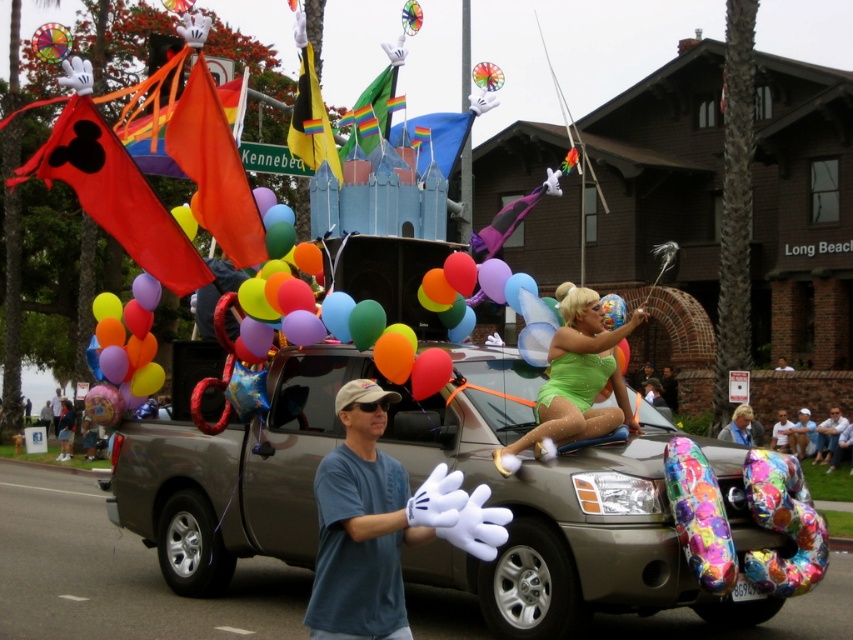
You are standing at the center of the parade route. You see an orange fabric flag at upper center located at point (213, 168). If you want to move closer to this flag, should you walk forward or backward?

The orange fabric flag at upper center is located at point (213, 168), which is in the upper center of the image. Since you are at the center of the parade route, walking forward would bring you closer to the upper center area where the flag is positioned.

You are standing in the crowd watching the parade. You notice the orange fabric flag at upper center and the rainbow fabric flag at center. Which flag appears closer to you?

The orange fabric flag at upper center appears closer to you because it is positioned closer to the viewer than the rainbow fabric flag at center.